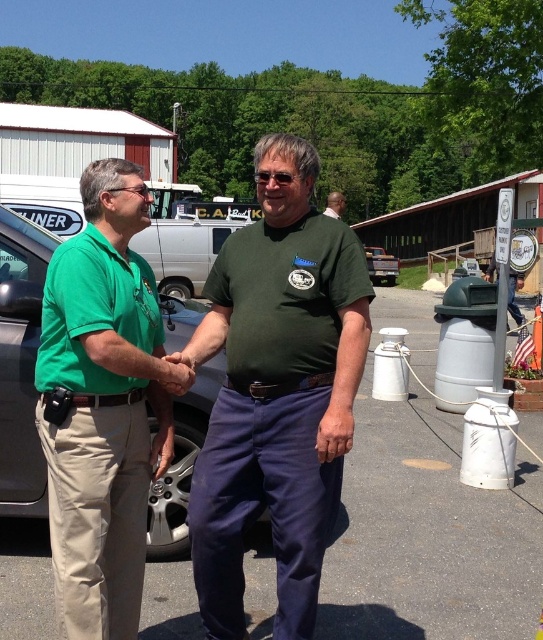
Between brushed metal truck at center and green shirt at center, which one has more height?

green shirt at center

Can you confirm if brushed metal truck at center is taller than green shirt at center?

In fact, brushed metal truck at center may be shorter than green shirt at center.

Is point (388, 284) less distant than point (342, 195)?

Yes.

Where is `brushed metal truck at center`? Image resolution: width=543 pixels, height=640 pixels. brushed metal truck at center is located at coordinates (381, 266).

Which is behind, point (132, 522) or point (337, 193)?

Positioned behind is point (337, 193).

Is the position of khaki pants at left more distant than that of green shirt at center?

No, khaki pants at left is in front of green shirt at center.

Does point (56, 595) come in front of point (331, 205)?

That is True.

This screenshot has height=640, width=543. I want to click on khaki pants at left, so click(x=103, y=404).

This screenshot has height=640, width=543. What do you see at coordinates (103, 404) in the screenshot?
I see `khaki pants at left` at bounding box center [103, 404].

At what (x,y) coordinates should I click in order to perform the action: click on khaki pants at left. Please return your answer as a coordinate pair (x, y). The width and height of the screenshot is (543, 640). Looking at the image, I should click on (103, 404).

I want to click on khaki pants at left, so click(x=103, y=404).

The height and width of the screenshot is (640, 543). I want to click on khaki pants at left, so click(103, 404).